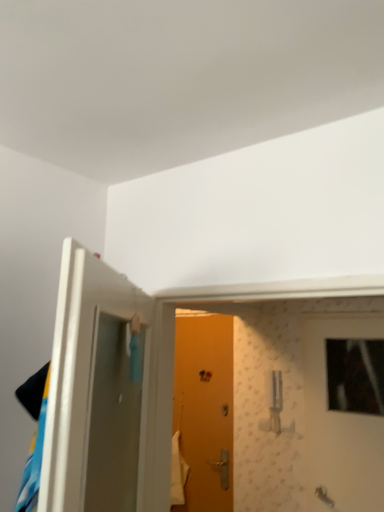
Find the location of a particular element. The image size is (384, 512). white glossy door at left, arranged as the third door when viewed from the right is located at coordinates (95, 391).

Considering the positions of objects orange matte door at center, which ranks as the 2th door in left-to-right order, and white glossy door at left, positioned as the first door in left-to-right order, in the image provided, who is more to the right, orange matte door at center, which ranks as the 2th door in left-to-right order, or white glossy door at left, positioned as the first door in left-to-right order,?

orange matte door at center, which ranks as the 2th door in left-to-right order, is more to the right.

Between orange matte door at center, the third door from the front, and white glossy door at left, arranged as the third door when viewed from the right, which one has more height?

Standing taller between the two is orange matte door at center, the third door from the front.

From the image's perspective, would you say orange matte door at center, the 1th door from the back, is shown under white glossy door at left, positioned as the first door in left-to-right order?

Yes, from the image's perspective, orange matte door at center, the 1th door from the back, is below white glossy door at left, positioned as the first door in left-to-right order.

Which object is further away from the camera taking this photo, wooden door at center, which ranks as the third door in left-to-right order, or white glossy door at left, which is counted as the 1th door, starting from the front?

wooden door at center, which ranks as the third door in left-to-right order, is further away from the camera.

Considering the positions of points (317, 332) and (90, 358), is point (317, 332) closer to camera compared to point (90, 358)?

No, it is behind (90, 358).

How distant is wooden door at center, which ranks as the 2th door in front-to-back order, from white glossy door at left, arranged as the third door when viewed from the right?

They are 4.99 feet apart.

Is white glossy door at left, positioned as the first door in left-to-right order, inside wooden door at center, which is the 2th door from back to front?

Actually, white glossy door at left, positioned as the first door in left-to-right order, is outside wooden door at center, which is the 2th door from back to front.

The image size is (384, 512). There is a white glossy door at left, arranged as the third door when viewed from the right. What are the coordinates of `the 1st door below it (from the image's perspective)` in the screenshot? It's located at (344, 410).

Is white glossy door at left, positioned as the first door in left-to-right order, thinner than wooden door at center, which is the 2th door from back to front?

No, white glossy door at left, positioned as the first door in left-to-right order, is not thinner than wooden door at center, which is the 2th door from back to front.

In the scene shown: From the image's perspective, between white glossy door at left, positioned as the first door in left-to-right order, and wooden door at center, which ranks as the 2th door in front-to-back order, who is located below?

wooden door at center, which ranks as the 2th door in front-to-back order, appears lower in the image.

Is white glossy door at left, which is counted as the 1th door, starting from the front, behind wooden door at center, arranged as the first door when viewed from the right?

No, white glossy door at left, which is counted as the 1th door, starting from the front, is closer to the camera.

Looking at this image, considering the sizes of objects orange matte door at center, the third door from the front, and wooden door at center, which ranks as the third door in left-to-right order, in the image provided, who is taller, orange matte door at center, the third door from the front, or wooden door at center, which ranks as the third door in left-to-right order,?

Standing taller between the two is orange matte door at center, the third door from the front.

Is orange matte door at center, arranged as the 2th door when viewed from the right, turned away from wooden door at center, which is the 2th door from back to front?

No, orange matte door at center, arranged as the 2th door when viewed from the right,'s orientation is not away from wooden door at center, which is the 2th door from back to front.

Is orange matte door at center, the 1th door from the back, at the right side of wooden door at center, which ranks as the third door in left-to-right order?

In fact, orange matte door at center, the 1th door from the back, is to the left of wooden door at center, which ranks as the third door in left-to-right order.

Considering the relative sizes of white glossy door at left, the 3th door in the back-to-front sequence, and orange matte door at center, arranged as the 2th door when viewed from the right, in the image provided, is white glossy door at left, the 3th door in the back-to-front sequence, smaller than orange matte door at center, arranged as the 2th door when viewed from the right,?

No, white glossy door at left, the 3th door in the back-to-front sequence, is not smaller than orange matte door at center, arranged as the 2th door when viewed from the right.

From the image's perspective, is white glossy door at left, arranged as the third door when viewed from the right, on orange matte door at center, arranged as the 2th door when viewed from the right?

Yes, from the image's perspective, white glossy door at left, arranged as the third door when viewed from the right, is over orange matte door at center, arranged as the 2th door when viewed from the right.

Is white glossy door at left, arranged as the third door when viewed from the right, inside or outside of orange matte door at center, the 1th door from the back?

white glossy door at left, arranged as the third door when viewed from the right, lies outside orange matte door at center, the 1th door from the back.

From the picture: Is orange matte door at center, which ranks as the 2th door in left-to-right order, at the back of wooden door at center, which ranks as the third door in left-to-right order?

No.

Considering the sizes of wooden door at center, which is the 2th door from back to front, and orange matte door at center, the third door from the front, in the image, is wooden door at center, which is the 2th door from back to front, wider or thinner than orange matte door at center, the third door from the front,?

Clearly, wooden door at center, which is the 2th door from back to front, has less width compared to orange matte door at center, the third door from the front.

You are a GUI agent. You are given a task and a screenshot of the screen. Output one action in this format:
    pyautogui.click(x=<x>, y=<y>)
    Task: Click on the door that appears on the left of orange matte door at center, which ranks as the 2th door in left-to-right order
    The width and height of the screenshot is (384, 512).
    Given the screenshot: What is the action you would take?
    pyautogui.click(x=95, y=391)

This screenshot has height=512, width=384. Identify the location of the 2nd door to the right when counting from the white glossy door at left, the 3th door in the back-to-front sequence. (344, 410).

Estimate the real-world distances between objects in this image. Which object is closer to orange matte door at center, the third door from the front, white glossy door at left, arranged as the third door when viewed from the right, or wooden door at center, which ranks as the third door in left-to-right order?

wooden door at center, which ranks as the third door in left-to-right order.

Looking at the image, which one is located closer to wooden door at center, which ranks as the third door in left-to-right order, orange matte door at center, the third door from the front, or white glossy door at left, which is counted as the 1th door, starting from the front?

orange matte door at center, the third door from the front, lies closer to wooden door at center, which ranks as the third door in left-to-right order, than the other object.

Estimate the real-world distances between objects in this image. Which object is further from orange matte door at center, arranged as the 2th door when viewed from the right, wooden door at center, which is the 2th door from back to front, or white glossy door at left, arranged as the third door when viewed from the right?

white glossy door at left, arranged as the third door when viewed from the right, lies further to orange matte door at center, arranged as the 2th door when viewed from the right, than the other object.

Which object lies further to the anchor point white glossy door at left, which is counted as the 1th door, starting from the front, wooden door at center, which ranks as the third door in left-to-right order, or orange matte door at center, arranged as the 2th door when viewed from the right?

orange matte door at center, arranged as the 2th door when viewed from the right.

From the image, which object appears to be farther from wooden door at center, which is the 2th door from back to front, white glossy door at left, arranged as the third door when viewed from the right, or orange matte door at center, the third door from the front?

white glossy door at left, arranged as the third door when viewed from the right.

Based on the photo, based on their spatial positions, is orange matte door at center, which ranks as the 2th door in left-to-right order, or wooden door at center, which is the 2th door from back to front, closer to white glossy door at left, arranged as the third door when viewed from the right?

Among the two, wooden door at center, which is the 2th door from back to front, is located nearer to white glossy door at left, arranged as the third door when viewed from the right.

You are a GUI agent. You are given a task and a screenshot of the screen. Output one action in this format:
    pyautogui.click(x=<x>, y=<y>)
    Task: Click on the door between white glossy door at left, the 3th door in the back-to-front sequence, and orange matte door at center, which ranks as the 2th door in left-to-right order, along the z-axis
    This screenshot has height=512, width=384.
    Given the screenshot: What is the action you would take?
    pyautogui.click(x=344, y=410)